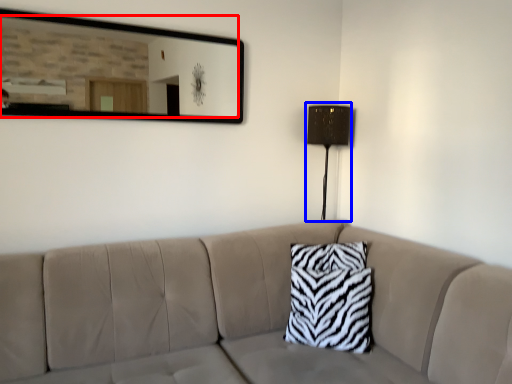
Question: Which object is closer to the camera taking this photo, mirror (highlighted by a red box) or table lamp (highlighted by a blue box)?

Choices:
 (A) mirror
 (B) table lamp

Answer: (A)